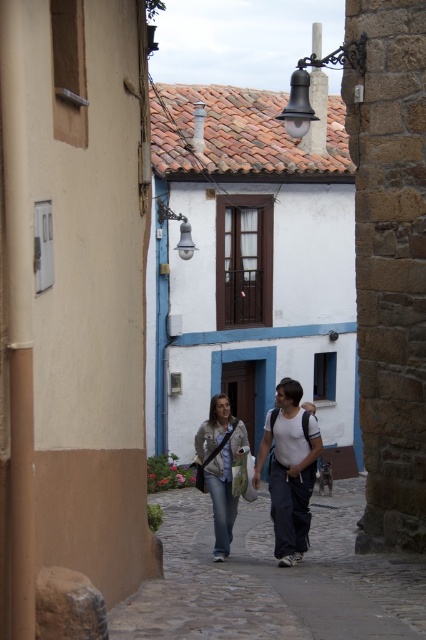
Which is more to the right, denim jeans at center or denim jacket at center?

denim jeans at center is more to the right.

Who is more forward, (213, 513) or (224, 440)?

Positioned in front is point (224, 440).

Between point (290, 387) and point (230, 481), which one is positioned in front?

Positioned in front is point (290, 387).

Image resolution: width=426 pixels, height=640 pixels. Find the location of `denim jeans at center`. denim jeans at center is located at coordinates (290, 468).